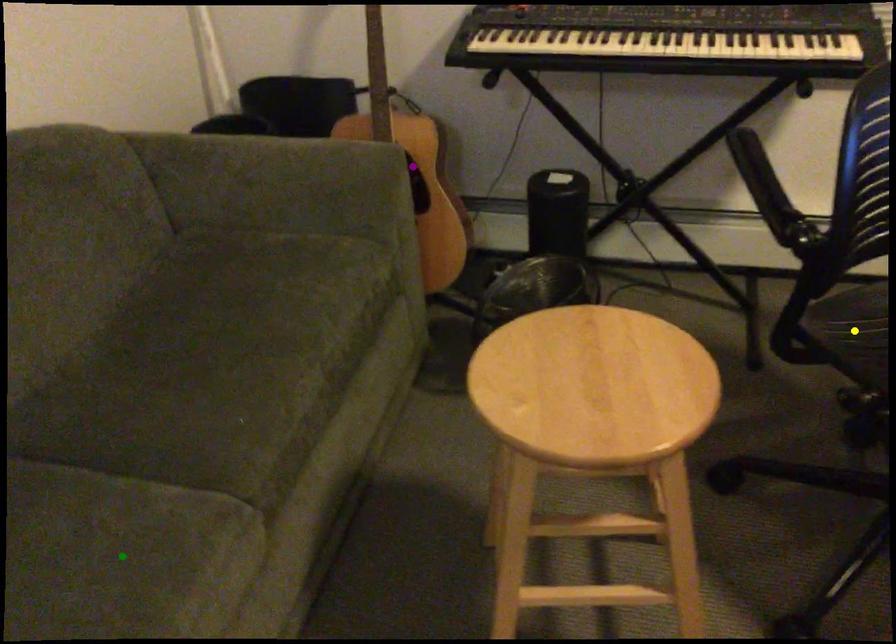
Order these from farthest to nearest:
purple point | yellow point | green point

purple point → yellow point → green point